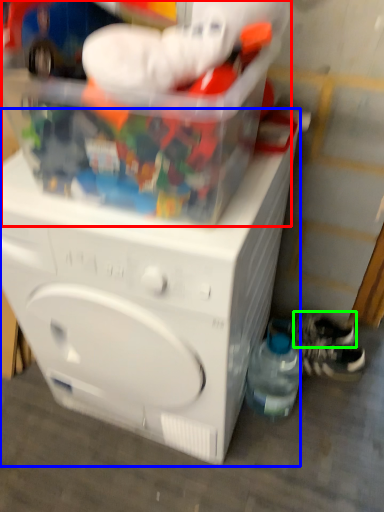
Question: Which object is positioned closest to toy (highlighted by a red box)? Select from washing machine (highlighted by a blue box) and shoe (highlighted by a green box).

Choices:
 (A) washing machine
 (B) shoe

Answer: (A)